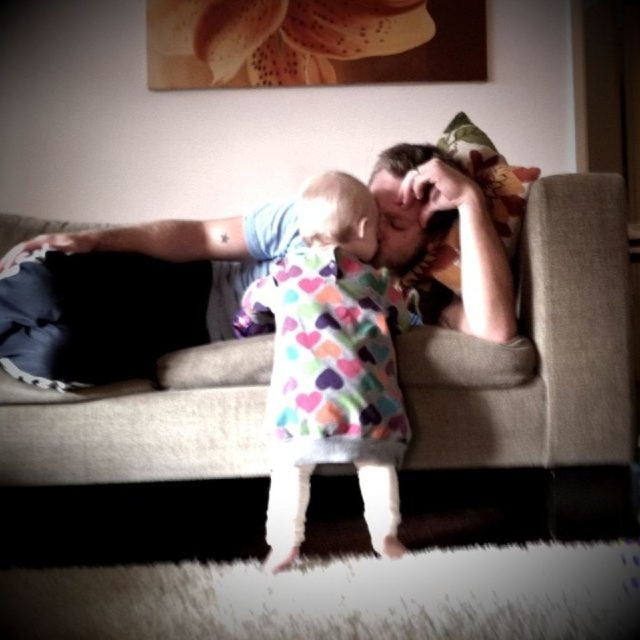
Does beige fabric couch at center have a greater width compared to multicolored heart-patterned dress at center?

Correct, the width of beige fabric couch at center exceeds that of multicolored heart-patterned dress at center.

Is beige fabric couch at center to the left of multicolored heart-patterned dress at center from the viewer's perspective?

No, beige fabric couch at center is not to the left of multicolored heart-patterned dress at center.

Describe the element at coordinates (547, 348) in the screenshot. I see `beige fabric couch at center` at that location.

This screenshot has height=640, width=640. I want to click on beige fabric couch at center, so click(547, 348).

Which is more to the left, beige fabric couch at center or matte blue shirt at center?

matte blue shirt at center

Is beige fabric couch at center behind matte blue shirt at center?

That is True.

Who is more forward, (586, 408) or (106, 262)?

Point (586, 408)

This screenshot has height=640, width=640. I want to click on beige fabric couch at center, so click(547, 348).

Is matte blue shirt at center to the right of multicolored heart-patterned dress at center from the viewer's perspective?

In fact, matte blue shirt at center is to the left of multicolored heart-patterned dress at center.

Who is lower down, matte blue shirt at center or multicolored heart-patterned dress at center?

multicolored heart-patterned dress at center is below.

Locate an element on the screen. Image resolution: width=640 pixels, height=640 pixels. matte blue shirt at center is located at coordinates (152, 288).